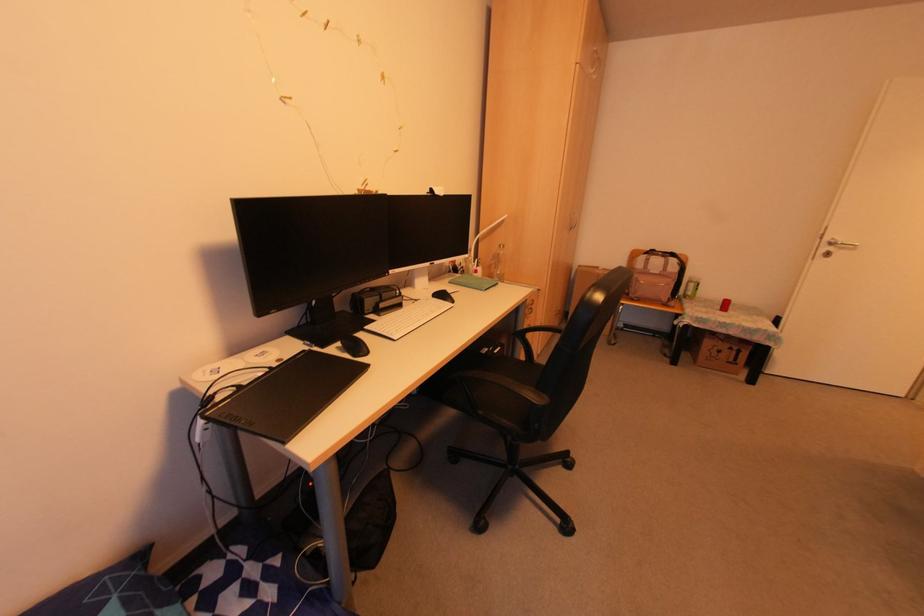
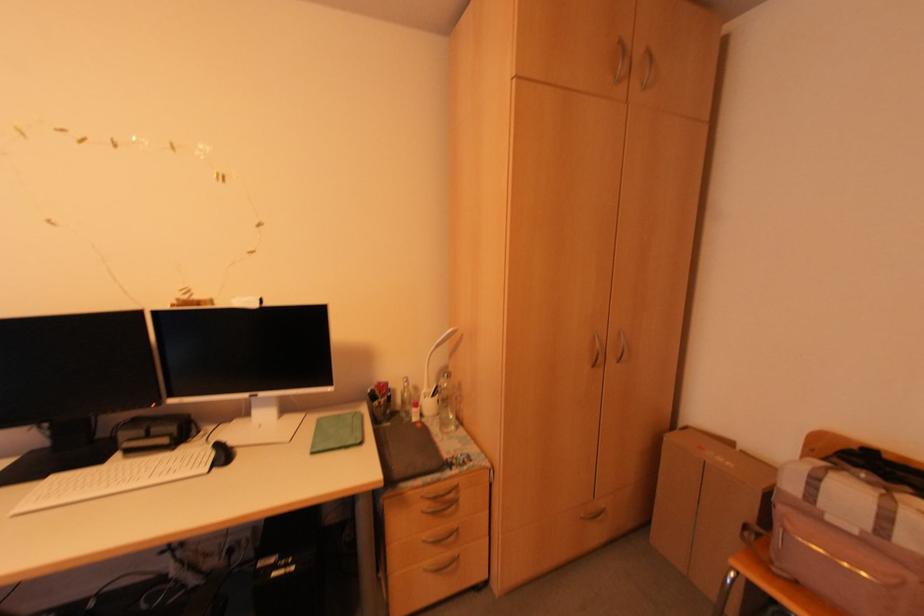
The point at (476,265) is marked in the first image. Where is the corresponding point in the second image?

(431, 395)